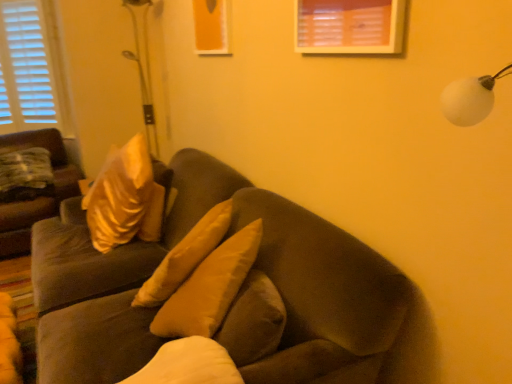
Question: Considering the relative sizes of suede-like brown couch at left, the 2th studio couch in the right-to-left sequence, and satin gold pillow at left in the image provided, is suede-like brown couch at left, the 2th studio couch in the right-to-left sequence, bigger than satin gold pillow at left?

Choices:
 (A) yes
 (B) no

Answer: (A)

Question: Is suede-like brown couch at left, which is counted as the 1th studio couch, starting from the back, wider than satin gold pillow at left?

Choices:
 (A) yes
 (B) no

Answer: (A)

Question: Is the surface of suede-like brown couch at left, which is the second studio couch from front to back, in direct contact with satin gold pillow at left?

Choices:
 (A) yes
 (B) no

Answer: (B)

Question: Is suede-like brown couch at left, which is the first studio couch from left to right, at the right side of satin gold pillow at left?

Choices:
 (A) yes
 (B) no

Answer: (B)

Question: Is suede-like brown couch at left, which is counted as the 1th studio couch, starting from the back, outside satin gold pillow at left?

Choices:
 (A) no
 (B) yes

Answer: (B)

Question: From the image's perspective, is metallic silver golf club at upper left located above or below satin gold pillow at left?

Choices:
 (A) below
 (B) above

Answer: (B)

Question: Is metallic silver golf club at upper left taller or shorter than satin gold pillow at left?

Choices:
 (A) tall
 (B) short

Answer: (A)

Question: Looking at their shapes, would you say metallic silver golf club at upper left is wider or thinner than satin gold pillow at left?

Choices:
 (A) thin
 (B) wide

Answer: (A)

Question: Considering their positions, is metallic silver golf club at upper left located in front of or behind satin gold pillow at left?

Choices:
 (A) front
 (B) behind

Answer: (A)

Question: Do you think metallic silver golf club at upper left is within suede brown couch at center, acting as the 1th studio couch starting from the front, or outside of it?

Choices:
 (A) inside
 (B) outside

Answer: (B)

Question: In the image, is metallic silver golf club at upper left on the left side or the right side of suede brown couch at center, the 2th studio couch positioned from the back?

Choices:
 (A) right
 (B) left

Answer: (B)

Question: Considering the positions of metallic silver golf club at upper left and suede brown couch at center, the first studio couch viewed from the right, in the image, is metallic silver golf club at upper left bigger or smaller than suede brown couch at center, the first studio couch viewed from the right,?

Choices:
 (A) big
 (B) small

Answer: (B)

Question: From a real-world perspective, is metallic silver golf club at upper left physically located above or below suede brown couch at center, acting as the 1th studio couch starting from the front?

Choices:
 (A) below
 (B) above

Answer: (B)

Question: From the image's perspective, is suede brown couch at center, acting as the second studio couch starting from the left, located above or below suede-like brown couch at left, which is the second studio couch from front to back?

Choices:
 (A) below
 (B) above

Answer: (A)

Question: Is suede brown couch at center, the 2th studio couch positioned from the back, in front of or behind suede-like brown couch at left, which is the first studio couch from left to right, in the image?

Choices:
 (A) front
 (B) behind

Answer: (A)